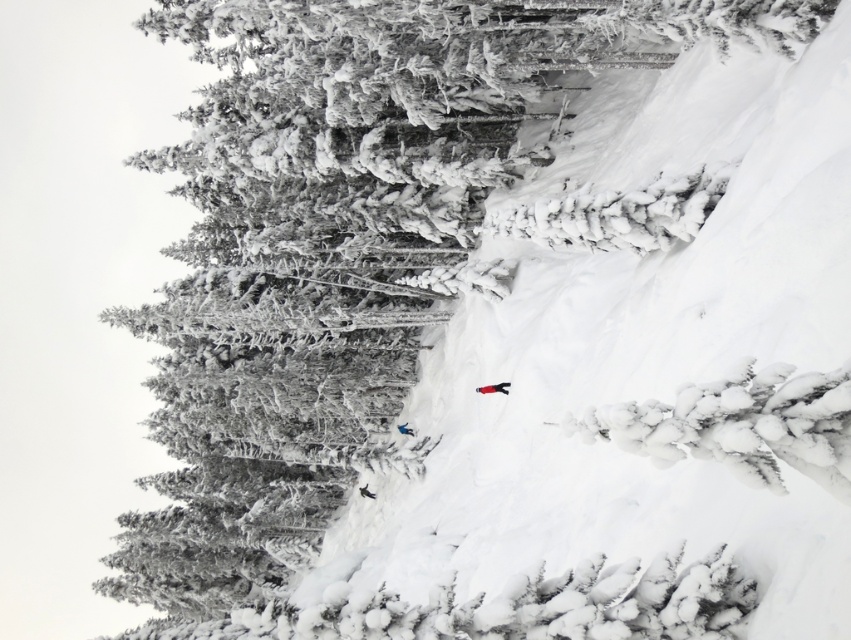
Can you confirm if white matte snowboard at center is thinner than white matte snowboarder at center?

Incorrect, white matte snowboard at center's width is not less than white matte snowboarder at center's.

This screenshot has width=851, height=640. Describe the element at coordinates (494, 387) in the screenshot. I see `white matte snowboard at center` at that location.

I want to click on white matte snowboard at center, so click(494, 387).